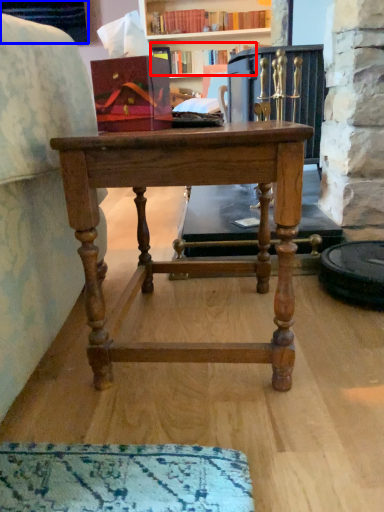
Question: Which point is closer to the camera, book (highlighted by a red box) or cabinetry (highlighted by a blue box)?

Choices:
 (A) book
 (B) cabinetry

Answer: (B)